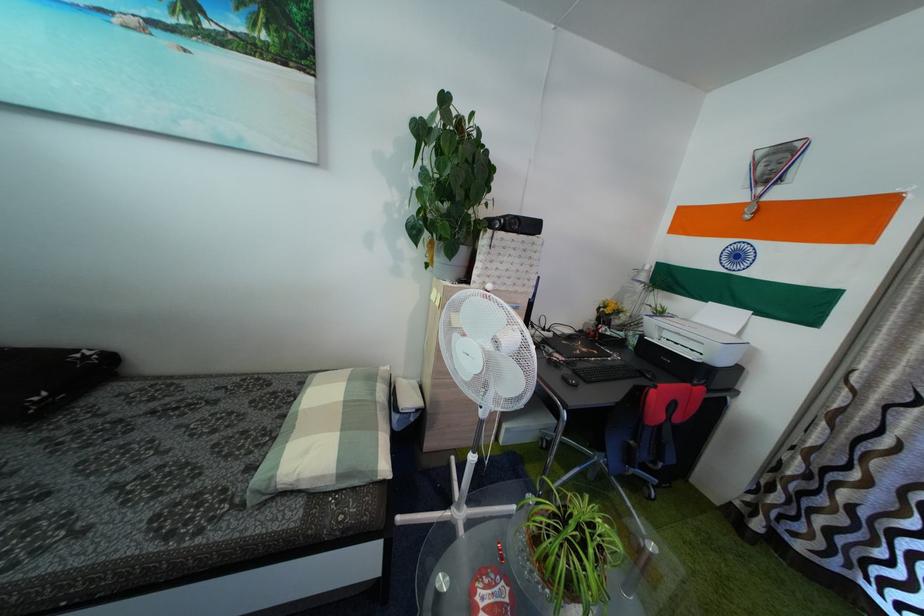
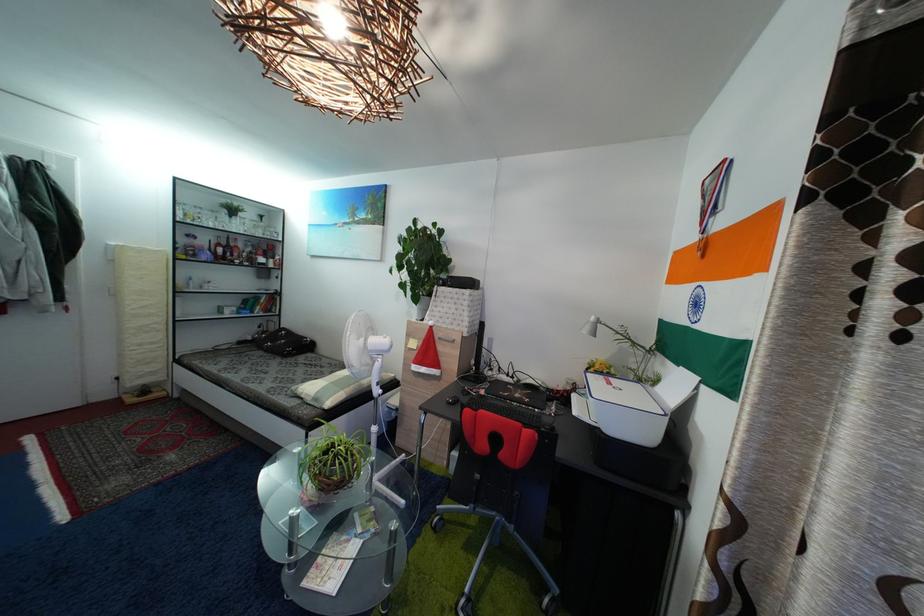
The point at (484,280) is marked in the first image. Where is the corresponding point in the second image?

(435, 321)